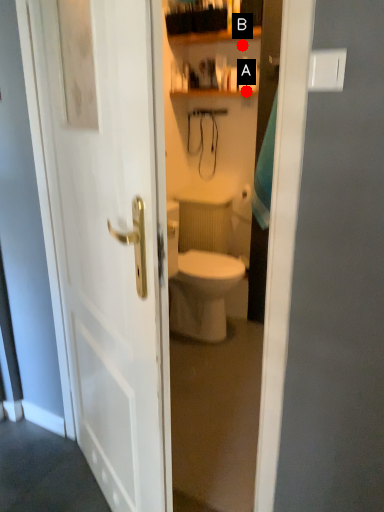
Question: Two points are circled on the image, labeled by A and B beside each circle. Which point is farther from the camera taking this photo?

Choices:
 (A) A is further
 (B) B is further

Answer: (B)